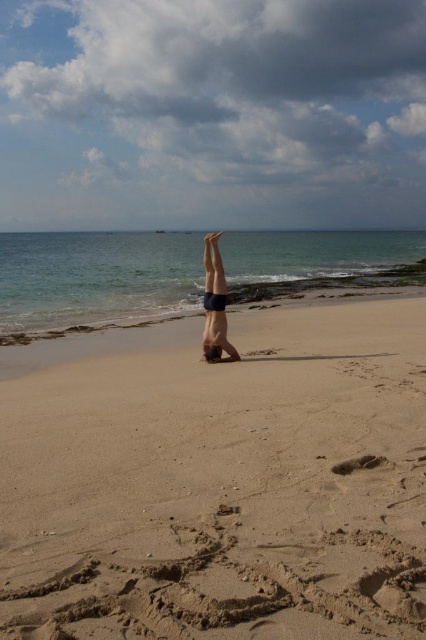
Who is taller, sandy tan at center or smooth skin person at center?

Standing taller between the two is smooth skin person at center.

What do you see at coordinates (221, 483) in the screenshot? This screenshot has width=426, height=640. I see `sandy tan at center` at bounding box center [221, 483].

The image size is (426, 640). I want to click on sandy tan at center, so click(x=221, y=483).